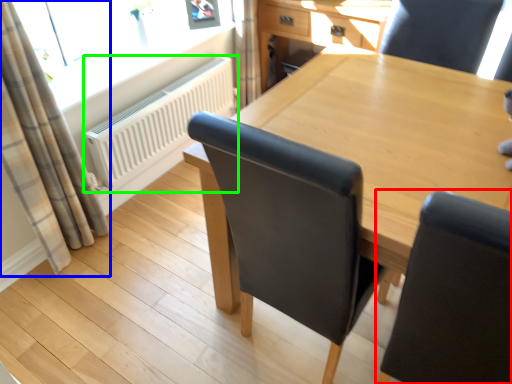
Question: Which is nearer to the chair (highlighted by a red box)? curtain (highlighted by a blue box) or radiator (highlighted by a green box).

Choices:
 (A) curtain
 (B) radiator

Answer: (A)